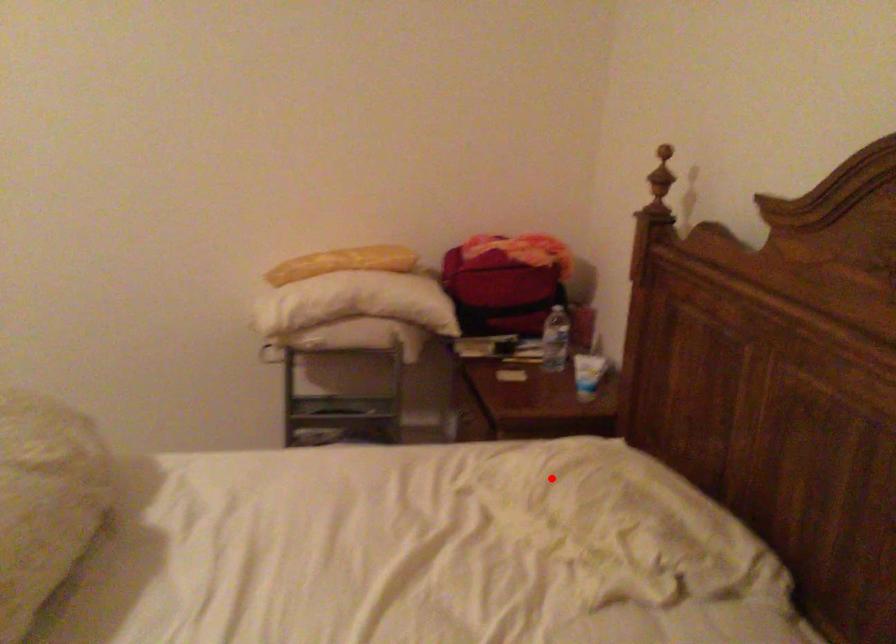
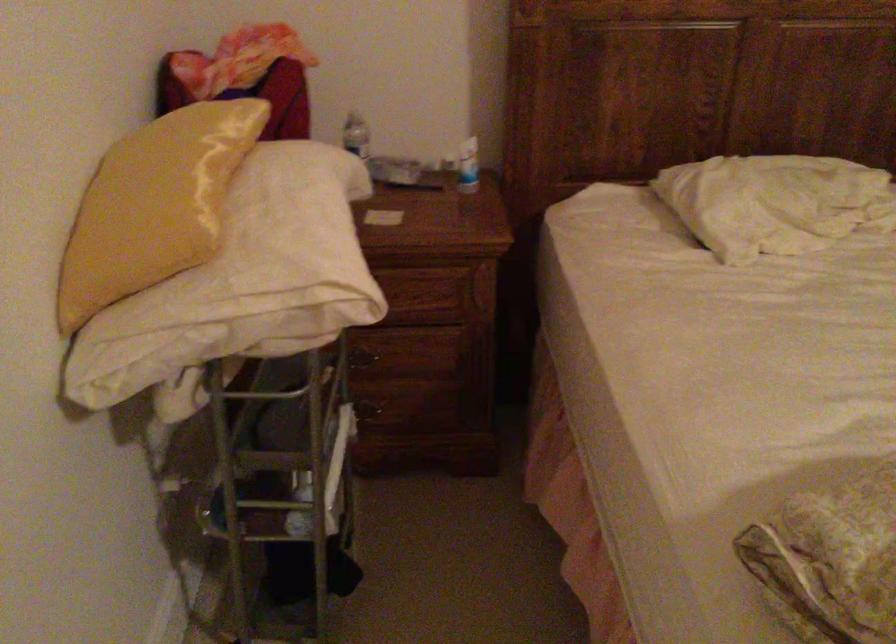
In the second image, find the point that corresponds to the highlighted location in the first image.

(774, 202)